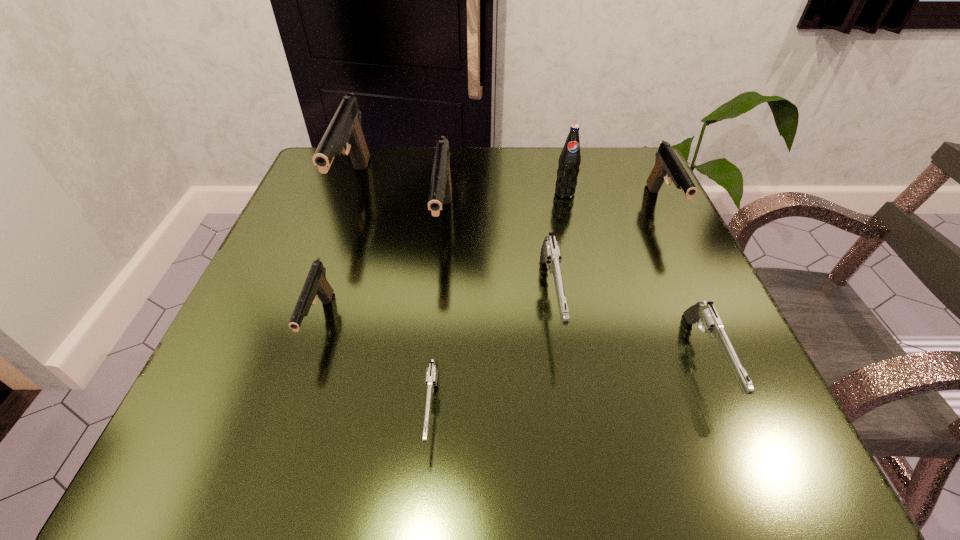
Identify the location of the tallest pistol. The image size is (960, 540). (345, 129).

Where is `black pop`? black pop is located at coordinates (570, 158).

Image resolution: width=960 pixels, height=540 pixels. In order to click on pop in this screenshot , I will do `click(570, 158)`.

I want to click on the sixth shortest pistol, so click(x=440, y=192).

This screenshot has height=540, width=960. Find the location of `the third smallest black pistol`. the third smallest black pistol is located at coordinates (440, 192).

This screenshot has width=960, height=540. Identify the location of the rightmost object. (667, 164).

Identify the location of the second smallest black pistol. (667, 164).

Locate an element on the screen. the biggest silver pistol is located at coordinates (550, 253).

Image resolution: width=960 pixels, height=540 pixels. Identify the location of the third pistol from right to left. (550, 253).

You are a GUI agent. You are given a task and a screenshot of the screen. Output one action in this format:
    pyautogui.click(x=<x>, y=<y>)
    Task: Click on the nearest black pistol
    The width and height of the screenshot is (960, 540).
    Given the screenshot: What is the action you would take?
    pyautogui.click(x=316, y=285)